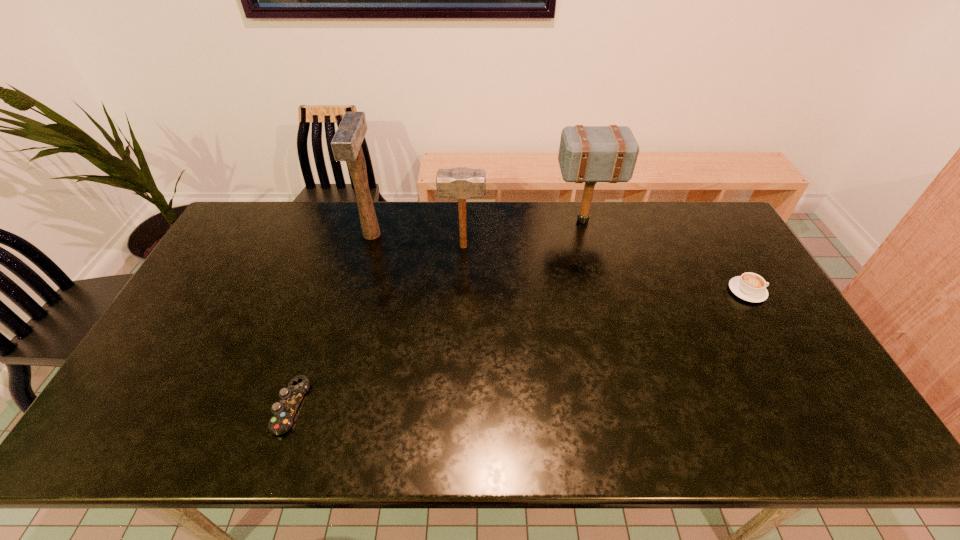
This screenshot has width=960, height=540. Find the location of `the tallest object`. the tallest object is located at coordinates (346, 144).

Identify the location of the leftmost mallet. (346, 144).

This screenshot has height=540, width=960. I want to click on the second tallest object, so click(x=590, y=154).

What are the coordinates of `the second tallest mallet` in the screenshot? It's located at (590, 154).

This screenshot has width=960, height=540. In order to click on the second mallet from left to right in this screenshot , I will do `click(461, 183)`.

The height and width of the screenshot is (540, 960). In order to click on the third object from left to right in this screenshot , I will do `click(461, 183)`.

At what (x,y) coordinates should I click in order to perform the action: click on the fourth farthest object. Please return your answer as a coordinate pair (x, y). Looking at the image, I should click on (751, 287).

Locate an element on the screen. The image size is (960, 540). cappuccino is located at coordinates (751, 287).

Where is `the nearest object`? This screenshot has height=540, width=960. the nearest object is located at coordinates (284, 410).

This screenshot has width=960, height=540. Identify the location of control. (284, 410).